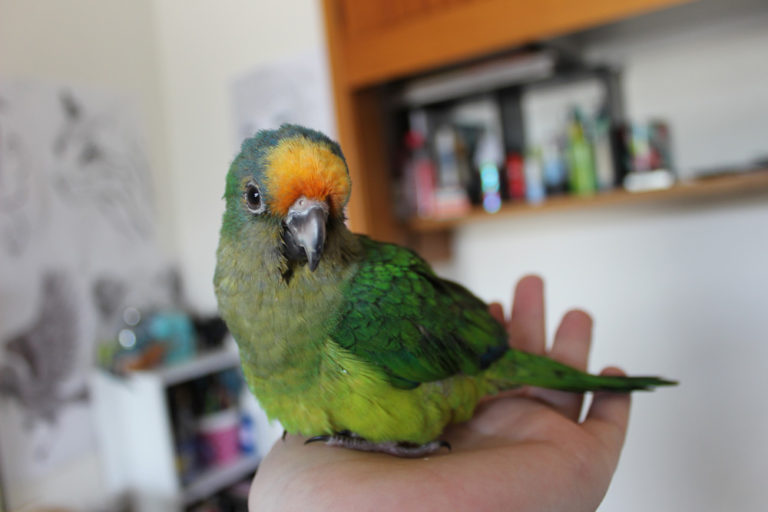
The width and height of the screenshot is (768, 512). Identify the location of bookcase. (147, 425).